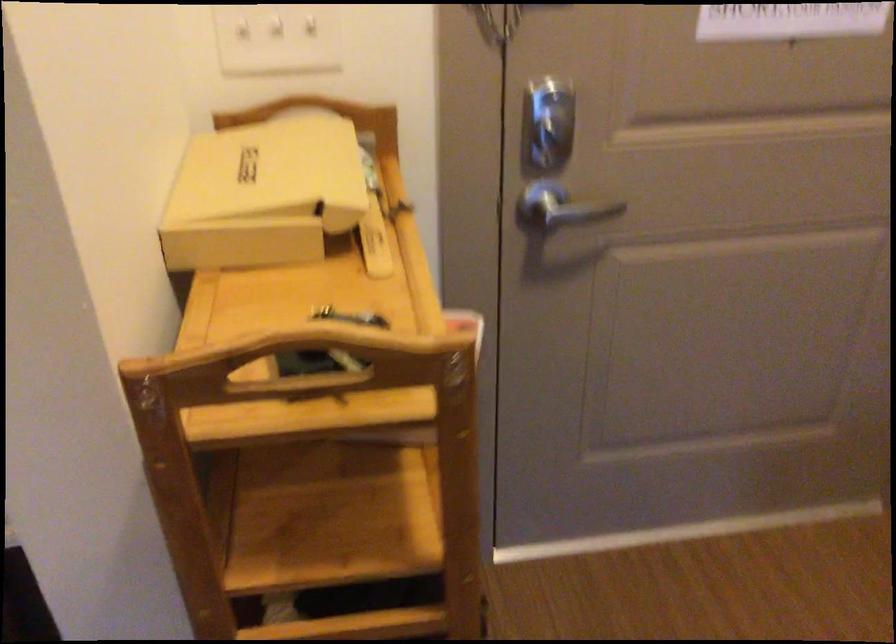
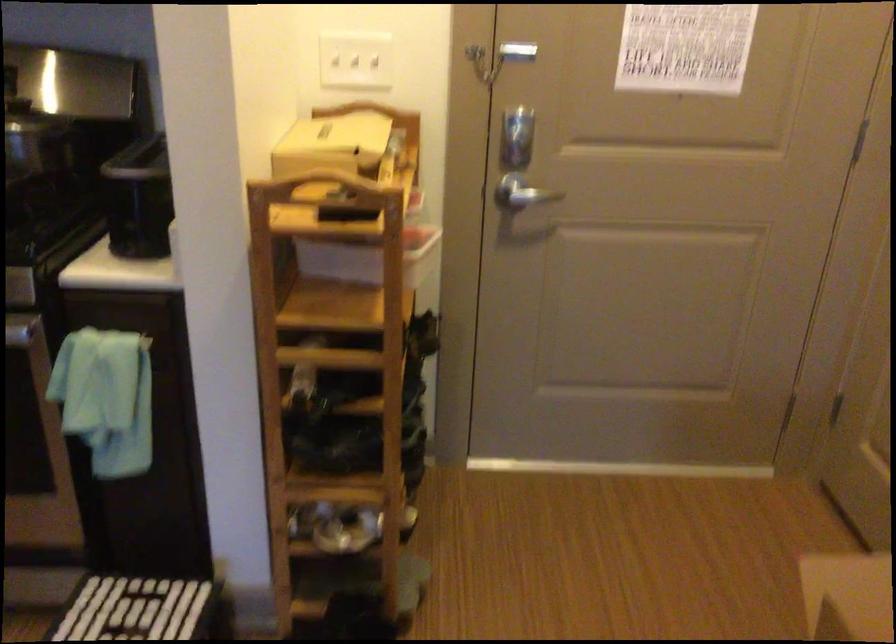
In the second image, find the point that corresponds to (266,203) in the first image.

(331, 144)